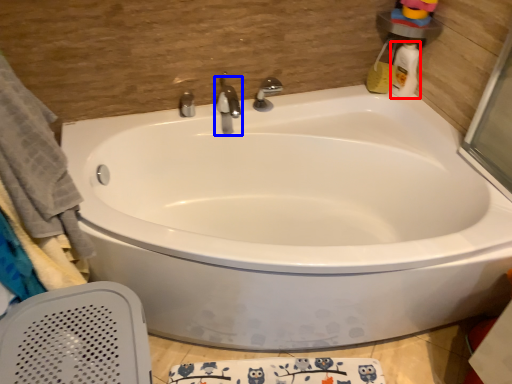
Question: Which point is closer to the camera, cleaning product (highlighted by a red box) or tap (highlighted by a blue box)?

Choices:
 (A) cleaning product
 (B) tap

Answer: (B)